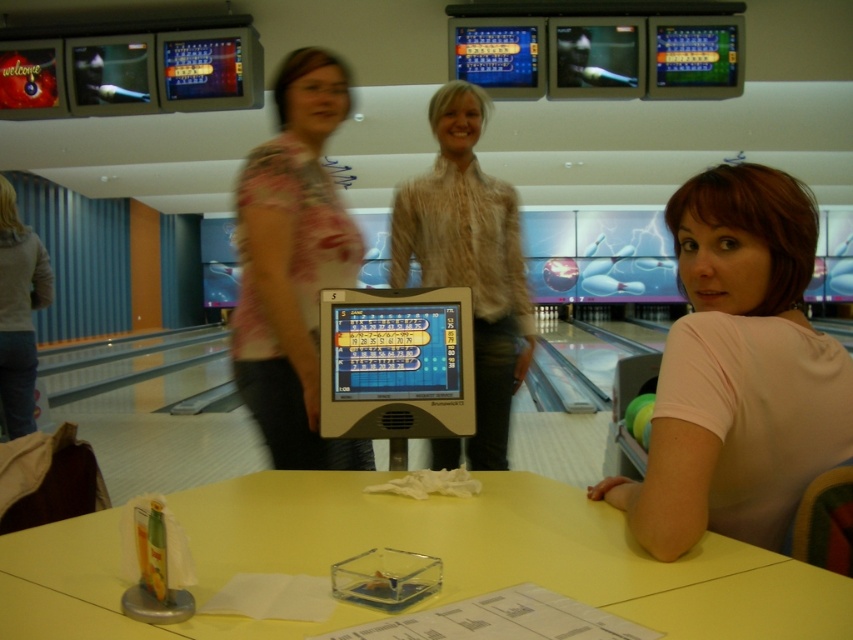
In the scene shown: Does yellow plastic table at center have a smaller size compared to denim pants at left?

Indeed, yellow plastic table at center has a smaller size compared to denim pants at left.

From the picture: Is yellow plastic table at center positioned in front of denim pants at left?

Yes.

Between point (537, 566) and point (39, 300), which one is positioned behind?

The point (39, 300) is more distant.

You are a GUI agent. You are given a task and a screenshot of the screen. Output one action in this format:
    pyautogui.click(x=<x>, y=<y>)
    Task: Click on the yellow plastic table at center
    
    Given the screenshot: What is the action you would take?
    pyautogui.click(x=508, y=552)

Does pink matte shirt at center lie behind denim pants at left?

That is False.

This screenshot has height=640, width=853. Identify the location of pink matte shirt at center. (738, 371).

Where is `pink matte shirt at center`? This screenshot has height=640, width=853. pink matte shirt at center is located at coordinates (738, 371).

Does floral fabric blouse at center appear over denim pants at left?

Indeed, floral fabric blouse at center is positioned over denim pants at left.

Can you confirm if floral fabric blouse at center is positioned to the right of denim pants at left?

Yes, floral fabric blouse at center is to the right of denim pants at left.

Locate an element on the screen. The width and height of the screenshot is (853, 640). floral fabric blouse at center is located at coordinates (293, 266).

Identify the location of floral fabric blouse at center. This screenshot has height=640, width=853. (293, 266).